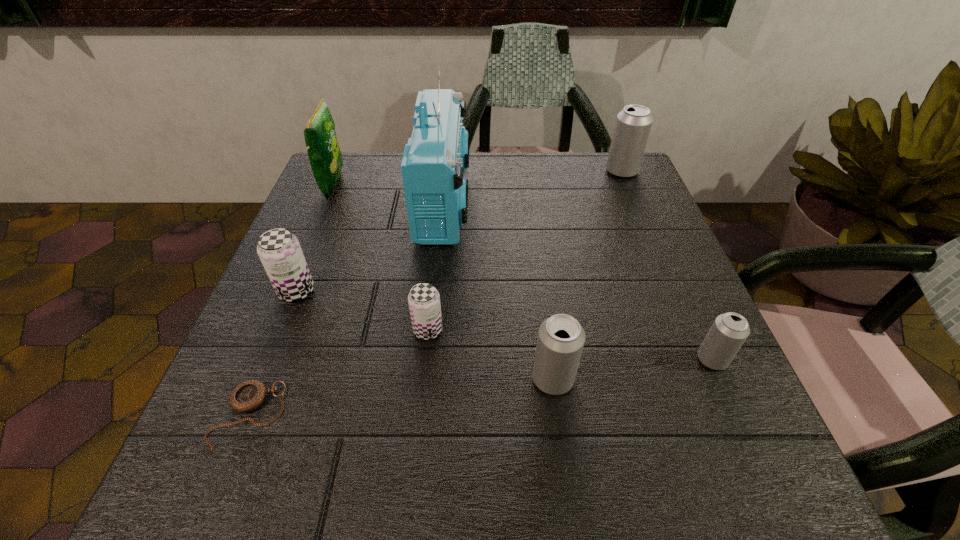
Locate an element on the screen. This screenshot has width=960, height=540. white beer can that stands as the closest to the right purple beer can is located at coordinates (561, 338).

Choose which white beer can is the third nearest neighbor to the crisp (potato chip). Please provide its 2D coordinates. Your answer should be formatted as a tuple, i.e. [(x, y)], where the tuple contains the x and y coordinates of a point satisfying the conditions above.

[(729, 331)]

I want to click on vacant space that satisfies the following two spatial constraints: 1. on the front-facing side of the third beer can from left to right; 2. on the left side of the tallest object, so pos(427,379).

Locate an element on the screen. This screenshot has height=540, width=960. vacant space that satisfies the following two spatial constraints: 1. on the front-facing side of the tallest object; 2. on the right side of the sixth object from left to right is located at coordinates (427, 379).

Find the location of `vacant area that satisfies the following two spatial constraints: 1. on the back side of the fourth nearest beer can; 2. on the front-facing side of the green crisp (potato chip)`. vacant area that satisfies the following two spatial constraints: 1. on the back side of the fourth nearest beer can; 2. on the front-facing side of the green crisp (potato chip) is located at coordinates (339, 185).

Where is `free space that satisfies the following two spatial constraints: 1. on the front-facing side of the smallest white beer can; 2. on the left side of the green crisp (potato chip)`? The width and height of the screenshot is (960, 540). free space that satisfies the following two spatial constraints: 1. on the front-facing side of the smallest white beer can; 2. on the left side of the green crisp (potato chip) is located at coordinates (261, 359).

Locate an element on the screen. Image resolution: width=960 pixels, height=540 pixels. free space that satisfies the following two spatial constraints: 1. on the front-facing side of the crisp (potato chip); 2. on the back side of the smallest white beer can is located at coordinates (261, 359).

Locate an element on the screen. This screenshot has width=960, height=540. vacant region that satisfies the following two spatial constraints: 1. on the front-facing side of the green crisp (potato chip); 2. on the right side of the smallest white beer can is located at coordinates (261, 359).

The height and width of the screenshot is (540, 960). Find the location of `vacant position in the image that satisfies the following two spatial constraints: 1. on the front-facing side of the blue radio receiver; 2. on the front side of the pocket watch`. vacant position in the image that satisfies the following two spatial constraints: 1. on the front-facing side of the blue radio receiver; 2. on the front side of the pocket watch is located at coordinates (423, 415).